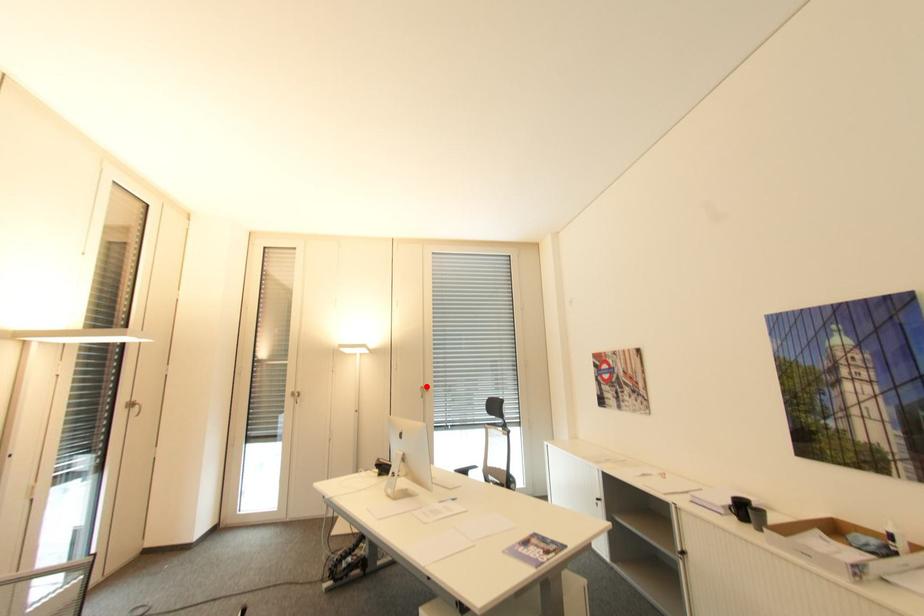
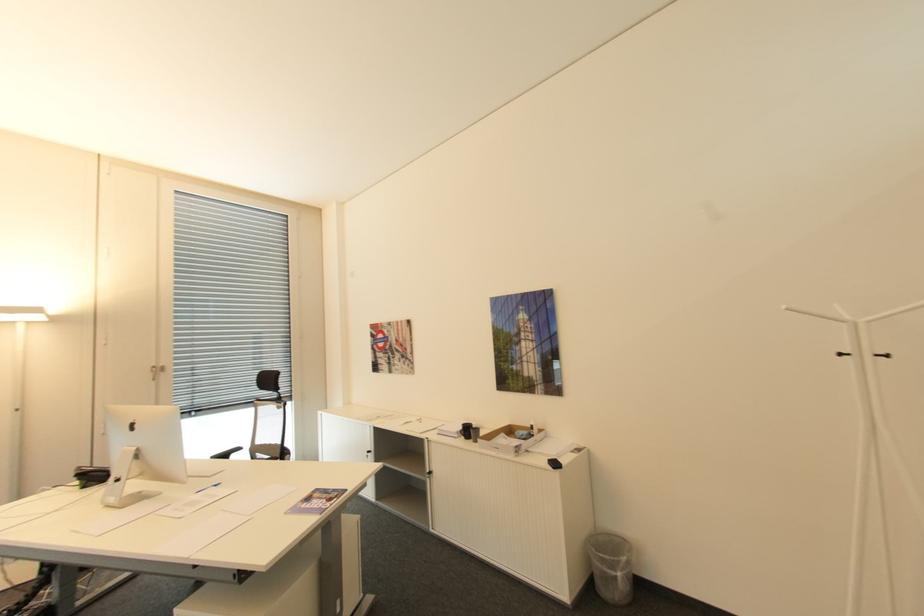
The point at the highlighted location is marked in the first image. Where is the corresponding point in the second image?

(159, 367)